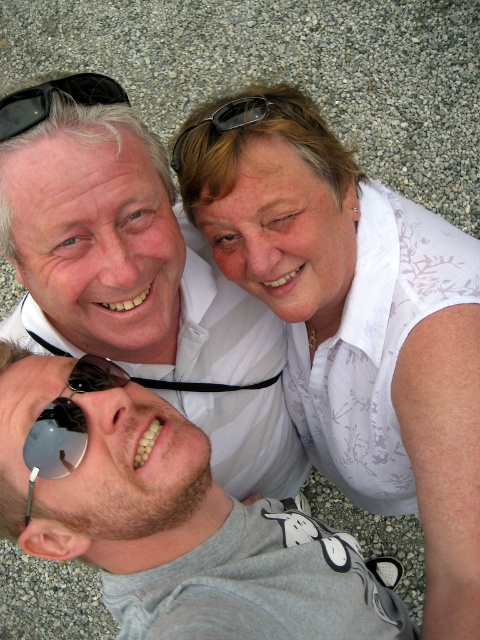
Based on the photo, can you confirm if white matte shirt at upper center is thinner than sunglasses at lower left?

Incorrect, white matte shirt at upper center's width is not less than sunglasses at lower left's.

Identify the location of white matte shirt at upper center. (136, 276).

Identify the location of white matte shirt at upper center. This screenshot has width=480, height=640. (136, 276).

Who is lower down, black rubber sunglasses at upper left or black plastic sunglasses at upper center?

black rubber sunglasses at upper left is below.

Does black rubber sunglasses at upper left lie in front of black plastic sunglasses at upper center?

Yes, it is in front of black plastic sunglasses at upper center.

This screenshot has width=480, height=640. What do you see at coordinates (50, 100) in the screenshot?
I see `black rubber sunglasses at upper left` at bounding box center [50, 100].

This screenshot has height=640, width=480. I want to click on black rubber sunglasses at upper left, so click(50, 100).

Which is behind, point (385, 609) or point (40, 426)?

The point (385, 609) is more distant.

The width and height of the screenshot is (480, 640). What do you see at coordinates (168, 516) in the screenshot?
I see `gray matte t-shirt at lower left` at bounding box center [168, 516].

Is point (117, 435) positioned behind point (58, 461)?

Yes, it is behind point (58, 461).

The image size is (480, 640). What are the coordinates of `gray matte t-shirt at lower left` in the screenshot? It's located at (168, 516).